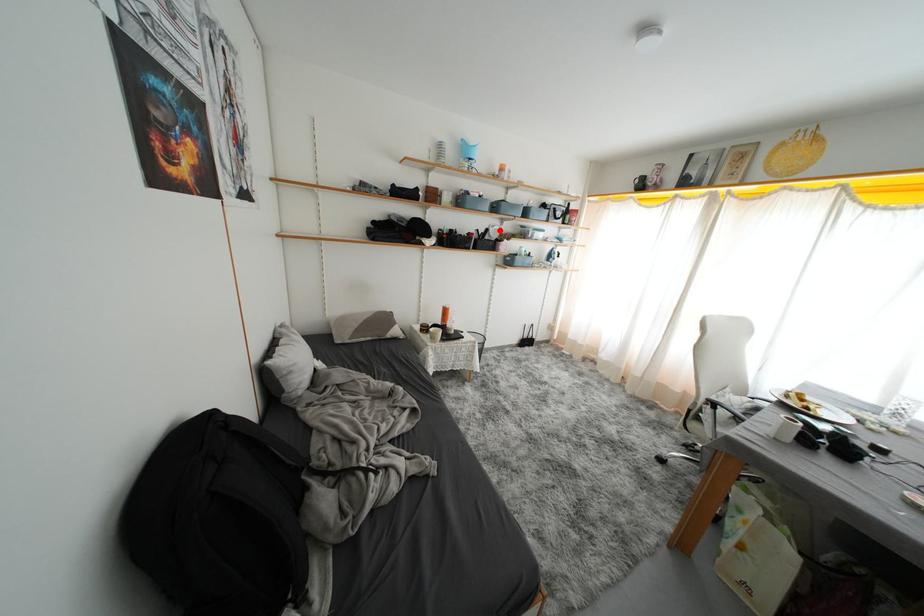
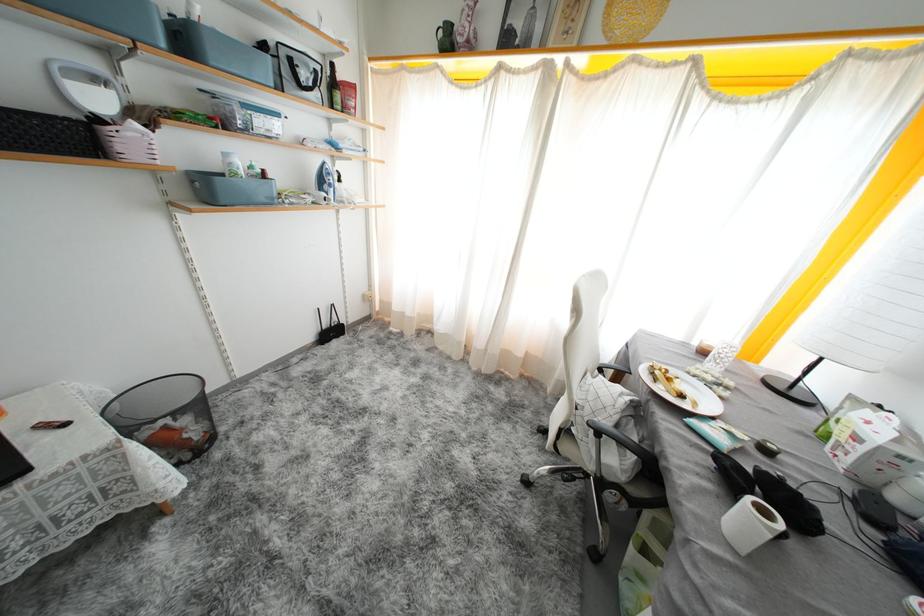
Question: I am providing you with two images of the same scene from different viewpoints. Image1 has a red point marked. In image2, the corresponding 3D location appears at what relative position? Reply with the corresponding letter.

Choices:
 (A) Closer
 (B) Farther

Answer: (B)